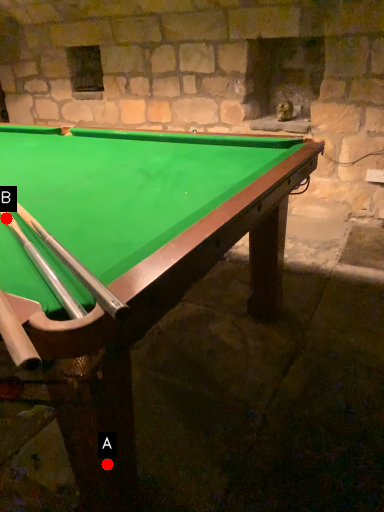
Question: Two points are circled on the image, labeled by A and B beside each circle. Which of the following is the farthest from the observer?

Choices:
 (A) A is further
 (B) B is further

Answer: (B)